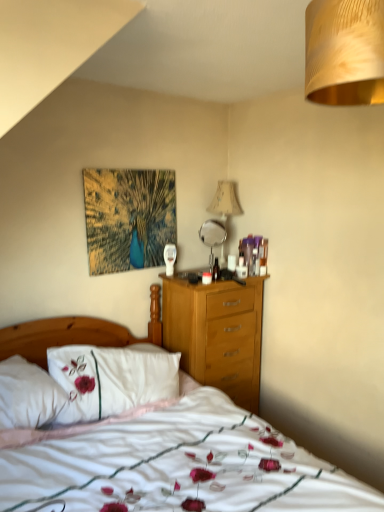
Question: Should I look upward or downward to see metallic silver mirror at center?

Choices:
 (A) up
 (B) down

Answer: (A)

Question: From a real-world perspective, does white soft bed at center sit lower than metallic silver mirror at center?

Choices:
 (A) no
 (B) yes

Answer: (B)

Question: Considering the relative positions of white soft bed at center and metallic silver mirror at center in the image provided, is white soft bed at center to the right of metallic silver mirror at center from the viewer's perspective?

Choices:
 (A) no
 (B) yes

Answer: (A)

Question: Is white soft bed at center shorter than metallic silver mirror at center?

Choices:
 (A) no
 (B) yes

Answer: (A)

Question: Does white soft bed at center have a greater width compared to metallic silver mirror at center?

Choices:
 (A) yes
 (B) no

Answer: (A)

Question: From the image's perspective, is white soft bed at center located beneath metallic silver mirror at center?

Choices:
 (A) yes
 (B) no

Answer: (A)

Question: Is white soft bed at center aimed at metallic silver mirror at center?

Choices:
 (A) no
 (B) yes

Answer: (A)

Question: Is white embroidered pillow at left to the right of gold textured lampshade at upper right, the second lamp when ordered from back to front, from the viewer's perspective?

Choices:
 (A) yes
 (B) no

Answer: (B)

Question: Is white embroidered pillow at left shorter than gold textured lampshade at upper right, marked as the first lamp in a front-to-back arrangement?

Choices:
 (A) yes
 (B) no

Answer: (A)

Question: Is white embroidered pillow at left turned away from gold textured lampshade at upper right, marked as the first lamp in a front-to-back arrangement?

Choices:
 (A) yes
 (B) no

Answer: (B)

Question: Does white embroidered pillow at left have a lesser width compared to gold textured lampshade at upper right, marked as the first lamp in a front-to-back arrangement?

Choices:
 (A) no
 (B) yes

Answer: (A)

Question: Can gold textured lampshade at upper right, marked as the first lamp in a front-to-back arrangement, be found inside white embroidered pillow at left?

Choices:
 (A) yes
 (B) no

Answer: (B)

Question: Considering the relative sizes of white embroidered pillow at left and gold textured lampshade at upper right, marked as the first lamp in a front-to-back arrangement, in the image provided, is white embroidered pillow at left wider than gold textured lampshade at upper right, marked as the first lamp in a front-to-back arrangement,?

Choices:
 (A) yes
 (B) no

Answer: (A)

Question: Can you confirm if gold textured lampshade at upper right, the second lamp when ordered from back to front, is positioned to the right of white soft bed at center?

Choices:
 (A) yes
 (B) no

Answer: (A)